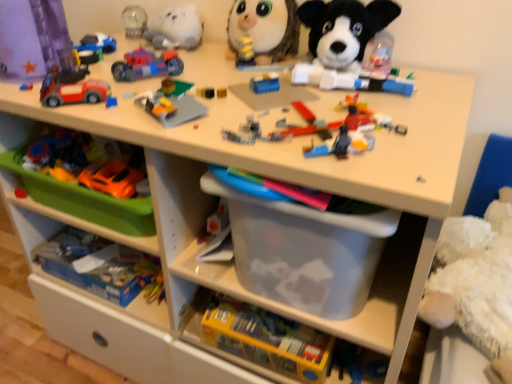
Question: Do you think translucent plastic motorcycle at upper center, placed as the fourth toy when sorted from top to bottom, is within soft plush dog at upper center, which is the 3th toy in top-to-bottom order, or outside of it?

Choices:
 (A) outside
 (B) inside

Answer: (A)

Question: Is translucent plastic motorcycle at upper center, placed as the fourth toy when sorted from top to bottom, in front of or behind soft plush dog at upper center, which is the seventh toy from bottom to top, in the image?

Choices:
 (A) behind
 (B) front

Answer: (A)

Question: Which object is the closest to the translucent plastic container at lower center, which ranks as the 1th toy in bottom-to-top order?

Choices:
 (A) blue cardboard box at lower left, arranged as the 2th toy when ordered from the bottom
 (B) translucent plastic bricks at center, which is counted as the fourth toy, starting from the bottom
 (C) green plastic tray at lower left
 (D) matte plastic toy car at upper left, the eighth toy when ordered from bottom to top
 (E) translucent plastic motorcycle at upper center, which ranks as the 6th toy in bottom-to-top order

Answer: (A)

Question: Estimate the real-world distances between objects in this image. Which object is closer to the matte plastic car at upper left, which is the fifth toy from top to bottom?

Choices:
 (A) translucent plastic bricks at center, which is counted as the fourth toy, starting from the bottom
 (B) translucent plastic container at lower center, which ranks as the 1th toy in bottom-to-top order
 (C) blue cardboard box at lower left, marked as the 8th toy in a top-to-bottom arrangement
 (D) soft plush dog at upper center, which is the seventh toy from bottom to top
 (E) yellow striped plush at upper center, arranged as the ninth toy when ordered from the bottom

Answer: (A)